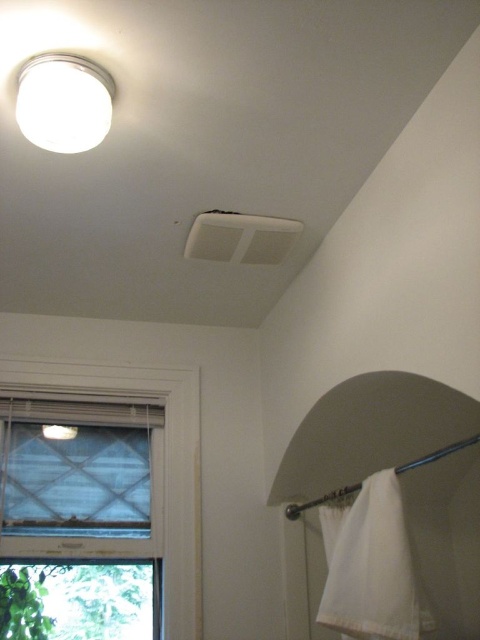
Question: Is white cotton towel at lower right in front of white matte light fixture at upper left?

Choices:
 (A) no
 (B) yes

Answer: (A)

Question: Considering the real-world distances, which object is farthest from the white matte light fixture at upper left?

Choices:
 (A) white cotton towel at lower right
 (B) white textured window at lower left

Answer: (B)

Question: Does white textured window at lower left appear on the left side of white cotton towel at lower right?

Choices:
 (A) yes
 (B) no

Answer: (A)

Question: Can you confirm if white cotton towel at lower right is wider than white matte light fixture at upper left?

Choices:
 (A) yes
 (B) no

Answer: (A)

Question: Based on their relative distances, which object is farther from the white matte light fixture at upper left?

Choices:
 (A) white textured window at lower left
 (B) white cotton towel at lower right

Answer: (A)

Question: Which point is closer to the camera taking this photo?

Choices:
 (A) (111, 81)
 (B) (333, 579)
 (C) (75, 387)

Answer: (A)